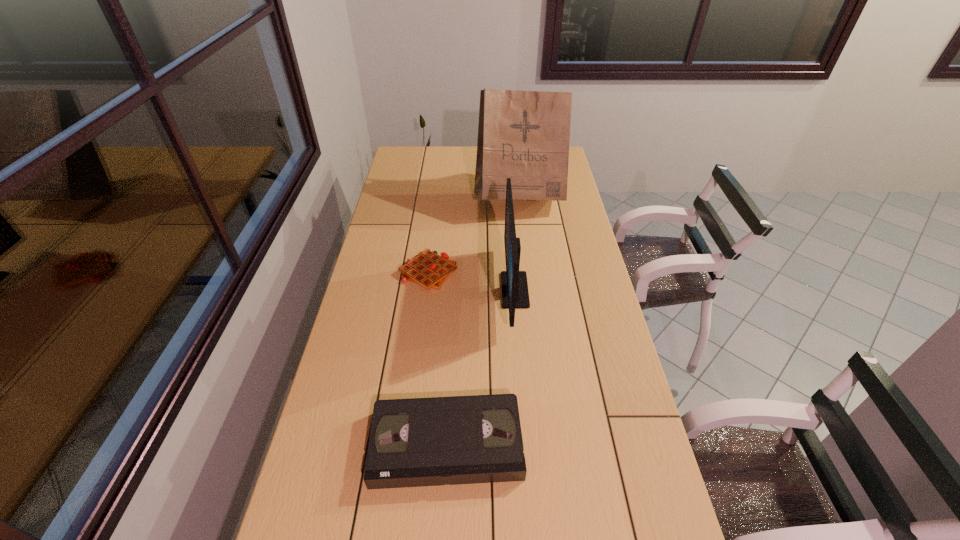
I want to click on grocery bag, so click(524, 135).

The height and width of the screenshot is (540, 960). What are the coordinates of `the tallest object` in the screenshot? It's located at (524, 135).

Locate an element on the screen. computer monitor is located at coordinates (515, 294).

Where is `videotape`? The width and height of the screenshot is (960, 540). videotape is located at coordinates (415, 442).

The height and width of the screenshot is (540, 960). What are the coordinates of `waffle` in the screenshot? It's located at (428, 269).

In order to click on vacant space located on the back of the grocery bag in this screenshot , I will do `click(513, 146)`.

You are a GUI agent. You are given a task and a screenshot of the screen. Output one action in this format:
    pyautogui.click(x=<x>, y=<y>)
    Task: Click on the free region located 0.390m on the screen side of the third shortest object
    The width and height of the screenshot is (960, 540).
    Given the screenshot: What is the action you would take?
    pyautogui.click(x=393, y=289)

At what (x,y) coordinates should I click in order to perform the action: click on free location located on the screen side of the third shortest object. Please return your answer as a coordinate pair (x, y). Looking at the image, I should click on (435, 289).

In order to click on vacant region located 0.340m on the screen side of the third shortest object in this screenshot , I will do `click(407, 289)`.

Identify the location of free location located 0.250m on the back of the videotape. click(x=453, y=335).